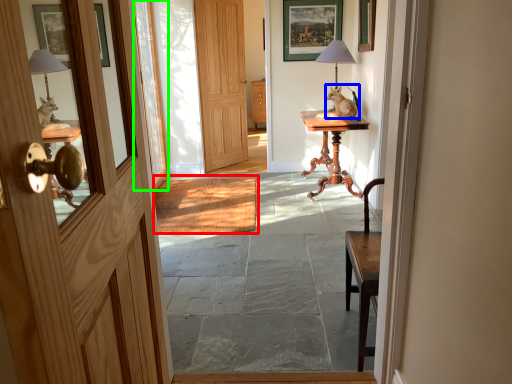
Question: Considering the real-world distances, which object is farthest from doormat (highlighted by a red box)? open (highlighted by a blue box) or glass door (highlighted by a green box)?

Choices:
 (A) open
 (B) glass door

Answer: (A)